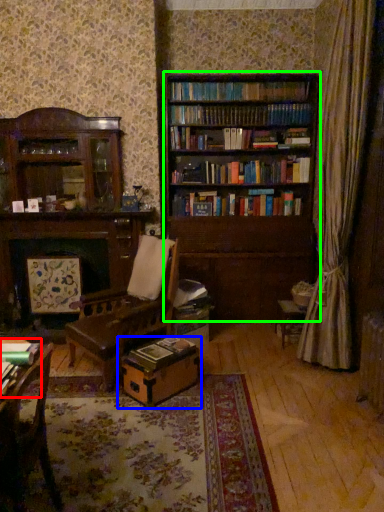
Question: Which object is positioned farthest from book (highlighted by a red box)? Select from cardboard box (highlighted by a blue box) and bookcase (highlighted by a green box).

Choices:
 (A) cardboard box
 (B) bookcase

Answer: (B)